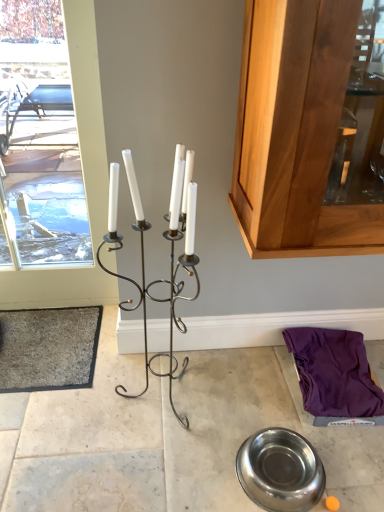
The height and width of the screenshot is (512, 384). Find the location of `vacant space underneath black wrought iron candle holder at center (from a real-world perspective)`. vacant space underneath black wrought iron candle holder at center (from a real-world perspective) is located at coordinates [153, 396].